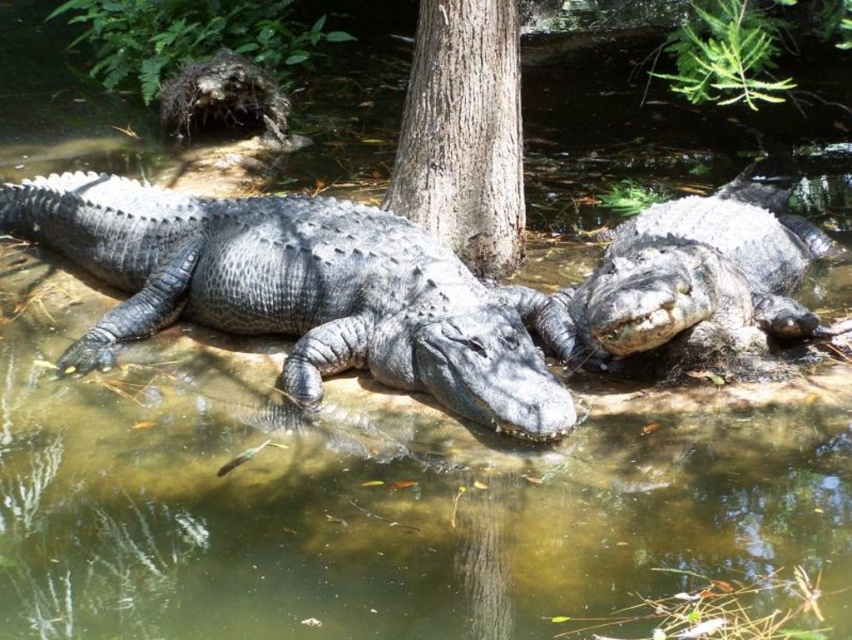
Question: Is gray rough skin crocodile at right positioned behind smooth gray tree trunk at center?

Choices:
 (A) no
 (B) yes

Answer: (A)

Question: Which of the following is the farthest from the observer?

Choices:
 (A) (493, 36)
 (B) (590, 278)

Answer: (A)

Question: Is slick gray crocodile at center closer to camera compared to gray rough skin crocodile at right?

Choices:
 (A) no
 (B) yes

Answer: (B)

Question: Which object appears closest to the camera in this image?

Choices:
 (A) gray rough skin crocodile at right
 (B) slick gray crocodile at center
 (C) smooth gray tree trunk at center

Answer: (B)

Question: Based on their relative distances, which object is nearer to the smooth gray tree trunk at center?

Choices:
 (A) gray rough skin crocodile at right
 (B) slick gray crocodile at center

Answer: (B)

Question: Can you confirm if slick gray crocodile at center is positioned to the right of smooth gray tree trunk at center?

Choices:
 (A) yes
 (B) no

Answer: (B)